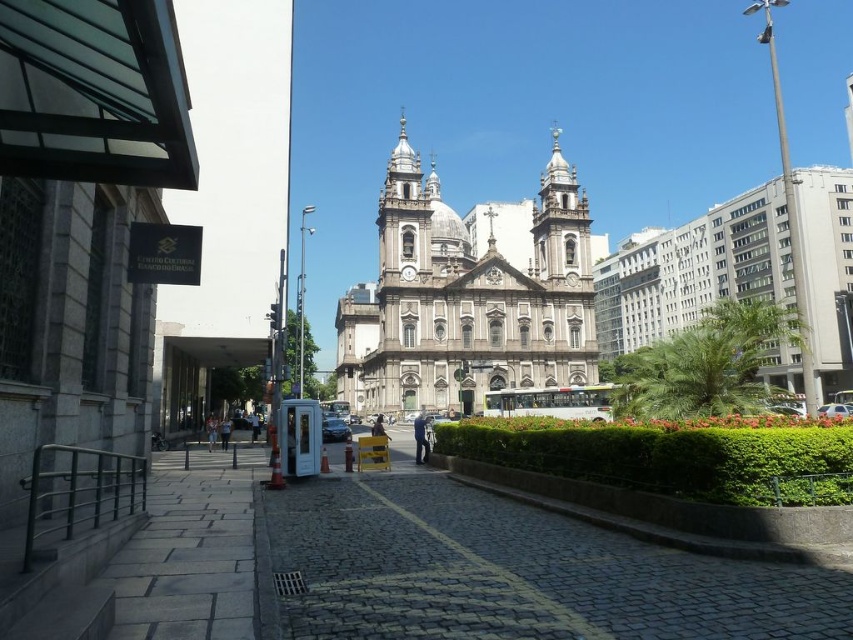
Question: Does black glossy car at center have a smaller size compared to silver metallic car at center?

Choices:
 (A) yes
 (B) no

Answer: (B)

Question: Which is farther from the white marble church at center?

Choices:
 (A) white stone church at center
 (B) silver metallic car at center

Answer: (B)

Question: Estimate the real-world distances between objects in this image. Which object is farther from the white marble church at center?

Choices:
 (A) black glossy car at center
 (B) silver metallic car at center

Answer: (B)

Question: Which object appears farthest from the camera in this image?

Choices:
 (A) white stone church at center
 (B) white marble church at center

Answer: (A)

Question: Is white marble church at center positioned at the back of black glossy car at center?

Choices:
 (A) yes
 (B) no

Answer: (A)

Question: Is white stone church at center wider than silver metallic car at center?

Choices:
 (A) no
 (B) yes

Answer: (B)